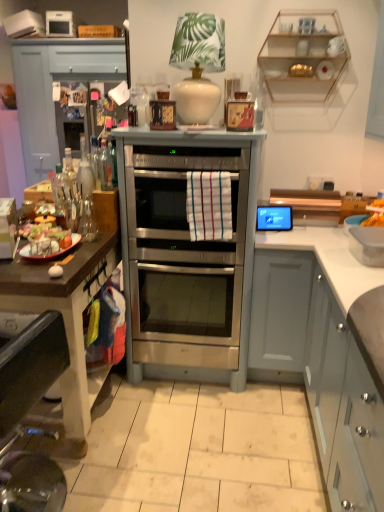
This screenshot has height=512, width=384. What do you see at coordinates (60, 188) in the screenshot?
I see `clear glass bottle at left, acting as the 2th bottle starting from the right` at bounding box center [60, 188].

In order to face clear glass bottle at left, acting as the 2th bottle starting from the right, should I rotate leftwards or rightwards?

A 17.235 degree turn to the left will do.

Locate an element on the screen. shiny plastic tray at left, the 1th food in the front-to-back sequence is located at coordinates (48, 238).

The width and height of the screenshot is (384, 512). Describe the element at coordinates (105, 166) in the screenshot. I see `clear glass bottle at left, the 2th bottle positioned from the left` at that location.

Describe the element at coordinates (209, 205) in the screenshot. This screenshot has width=384, height=512. I see `white striped towel at center` at that location.

Measure the distance between white matte cabinet at right, arranged as the third cabinetry when viewed from the left, and camera.

The depth of white matte cabinet at right, arranged as the third cabinetry when viewed from the left, is 3.59 feet.

Image resolution: width=384 pixels, height=512 pixels. I want to click on clear glass bottle at left, arranged as the first bottle when viewed from the left, so click(60, 188).

Considering the relative positions of shiny plastic tray at left, the 1th food in the front-to-back sequence, and matte black tablet at upper right in the image provided, is shiny plastic tray at left, the 1th food in the front-to-back sequence, to the left of matte black tablet at upper right from the viewer's perspective?

Yes.

Identify the location of appliance that appears on the right of shiny plastic tray at left, arranged as the second food when viewed from the right. This screenshot has height=512, width=384. (274, 218).

Consider the image. Is shiny plastic tray at left, the 1th food in the front-to-back sequence, aimed at matte black tablet at upper right?

No, shiny plastic tray at left, the 1th food in the front-to-back sequence, is not aimed at matte black tablet at upper right.

Considering the relative sizes of shiny plastic tray at left, arranged as the second food when viewed from the right, and matte black tablet at upper right in the image provided, is shiny plastic tray at left, arranged as the second food when viewed from the right, wider than matte black tablet at upper right?

Correct, the width of shiny plastic tray at left, arranged as the second food when viewed from the right, exceeds that of matte black tablet at upper right.

Is matte black tablet at upper right further to camera compared to white striped towel at center?

Yes.

Looking at the image, does matte black tablet at upper right seem bigger or smaller compared to white striped towel at center?

matte black tablet at upper right is smaller than white striped towel at center.

Considering the relative sizes of matte black tablet at upper right and white striped towel at center in the image provided, is matte black tablet at upper right thinner than white striped towel at center?

No.

Is yellow crispy chips at right, marked as the second food in a front-to-back arrangement, spatially inside clear glass shelves at upper right, or outside of it?

yellow crispy chips at right, marked as the second food in a front-to-back arrangement, cannot be found inside clear glass shelves at upper right.

Considering their positions, is yellow crispy chips at right, placed as the 2th food when sorted from left to right, located in front of or behind clear glass shelves at upper right?

yellow crispy chips at right, placed as the 2th food when sorted from left to right, is in front of clear glass shelves at upper right.

Does yellow crispy chips at right, marked as the second food in a front-to-back arrangement, have a greater width compared to clear glass shelves at upper right?

Yes.

Is yellow crispy chips at right, marked as the second food in a front-to-back arrangement, taller than clear glass shelves at upper right?

No.

Which of these two, matte black tablet at upper right or white matte cabinet at center, which ranks as the 2th cabinetry in bottom-to-top order, stands taller?

white matte cabinet at center, which ranks as the 2th cabinetry in bottom-to-top order, is taller.

Can you tell me how much matte black tablet at upper right and white matte cabinet at center, the second cabinetry when ordered from right to left, differ in facing direction?

0.0244 degrees separate the facing orientations of matte black tablet at upper right and white matte cabinet at center, the second cabinetry when ordered from right to left.

In the scene shown: From the image's perspective, is matte black tablet at upper right under white matte cabinet at center, the second cabinetry when ordered from right to left?

No.

Which object is positioned more to the left, matte black tablet at upper right or white matte cabinet at center, the 2th cabinetry viewed from the back?

Positioned to the left is matte black tablet at upper right.

Which is closer, (223, 180) or (334, 23)?

Point (223, 180) appears to be closer to the viewer than point (334, 23).

Which of these two, white striped towel at center or clear glass shelves at upper right, stands shorter?

white striped towel at center is shorter.

Could clear glass shelves at upper right be considered to be inside white striped towel at center?

No, clear glass shelves at upper right is located outside of white striped towel at center.

From the image's perspective, is white matte cabinet at center, the second cabinetry when ordered from right to left, on top of clear glass shelves at upper right?

Incorrect, from the image's perspective, white matte cabinet at center, the second cabinetry when ordered from right to left, is lower than clear glass shelves at upper right.

From a real-world perspective, is white matte cabinet at center, acting as the second cabinetry starting from the front, physically below clear glass shelves at upper right?

Yes, from a real-world perspective, white matte cabinet at center, acting as the second cabinetry starting from the front, is under clear glass shelves at upper right.

Between white matte cabinet at center, acting as the second cabinetry starting from the front, and clear glass shelves at upper right, which one appears on the left side from the viewer's perspective?

From the viewer's perspective, white matte cabinet at center, acting as the second cabinetry starting from the front, appears more on the left side.

Is yellow crispy chips at right, which is the 1th food in back-to-front order, spatially inside stainless steel oven at center, or outside of it?

yellow crispy chips at right, which is the 1th food in back-to-front order, cannot be found inside stainless steel oven at center.

Considering the relative sizes of yellow crispy chips at right, marked as the second food in a front-to-back arrangement, and stainless steel oven at center in the image provided, is yellow crispy chips at right, marked as the second food in a front-to-back arrangement, bigger than stainless steel oven at center?

No.

Between yellow crispy chips at right, marked as the second food in a front-to-back arrangement, and stainless steel oven at center, which one has smaller width?

With smaller width is yellow crispy chips at right, marked as the second food in a front-to-back arrangement.

Consider the image. Can you confirm if yellow crispy chips at right, which is the 1th food in back-to-front order, is taller than stainless steel oven at center?

In fact, yellow crispy chips at right, which is the 1th food in back-to-front order, may be shorter than stainless steel oven at center.

This screenshot has height=512, width=384. I want to click on appliance above the shiny plastic tray at left, the 1th food in the front-to-back sequence (from the image's perspective), so click(274, 218).

At what (x,y) coordinates should I click in order to perform the action: click on appliance behind the white striped towel at center. Please return your answer as a coordinate pair (x, y). The width and height of the screenshot is (384, 512). Looking at the image, I should click on (274, 218).

From the image, which object appears to be nearer to clear glass shelves at upper right, white matte cabinet at center, the second cabinetry when ordered from right to left, or white matte cabinet at right, arranged as the third cabinetry when viewed from the left?

white matte cabinet at center, the second cabinetry when ordered from right to left.

Looking at the image, which one is located closer to clear glass bottle at left, arranged as the first bottle when viewed from the left, matte blue cabinet at left, positioned as the third cabinetry in front-to-back order, or white striped towel at center?

white striped towel at center is closer to clear glass bottle at left, arranged as the first bottle when viewed from the left.

From the image, which object appears to be nearer to shiny plastic tray at left, the 1th food in the front-to-back sequence, yellow crispy chips at right, placed as the 2th food when sorted from left to right, or stainless steel oven at center?

Based on the image, stainless steel oven at center appears to be nearer to shiny plastic tray at left, the 1th food in the front-to-back sequence.

Considering their positions, is stainless steel oven at center positioned further to yellow crispy chips at right, marked as the second food in a front-to-back arrangement, than clear glass shelves at upper right?

stainless steel oven at center is further to yellow crispy chips at right, marked as the second food in a front-to-back arrangement.

Which object lies nearer to the anchor point white matte cabinet at center, which ranks as the 2th cabinetry in bottom-to-top order, brushed metal drawer at upper left or shiny plastic tray at left, arranged as the second food when viewed from the back?

The object closer to white matte cabinet at center, which ranks as the 2th cabinetry in bottom-to-top order, is shiny plastic tray at left, arranged as the second food when viewed from the back.

Looking at the image, which one is located further to clear glass bottle at left, the 2th bottle positioned from the left, clear glass bottle at left, acting as the 2th bottle starting from the right, or matte black tablet at upper right?

matte black tablet at upper right lies further to clear glass bottle at left, the 2th bottle positioned from the left, than the other object.

Which object lies further to the anchor point clear glass shelves at upper right, white matte cabinet at right, which is the 3th cabinetry in top-to-bottom order, or white striped towel at center?

white matte cabinet at right, which is the 3th cabinetry in top-to-bottom order.

When comparing their distances from matte black tablet at upper right, does stainless steel oven at center or clear glass bottle at left, acting as the 2th bottle starting from the right, seem further?

Among the two, clear glass bottle at left, acting as the 2th bottle starting from the right, is located further to matte black tablet at upper right.

The height and width of the screenshot is (512, 384). I want to click on oven between white matte cabinet at center, the 2th cabinetry viewed from the back, and matte blue cabinet at left, which ranks as the 1th cabinetry in left-to-right order, in the front-back direction, so pos(183,259).

You are a GUI agent. You are given a task and a screenshot of the screen. Output one action in this format:
    pyautogui.click(x=<x>, y=<y>)
    Task: Click on the drawer positioned between stainless steel oven at center and matte blue cabinet at left, which ranks as the 1th cabinetry in left-to-right order, from near to far
    The width and height of the screenshot is (384, 512).
    Given the screenshot: What is the action you would take?
    pyautogui.click(x=87, y=59)

Locate an element on the screen. appliance located between shiny plastic tray at left, arranged as the second food when viewed from the right, and matte blue cabinet at left, which appears as the third cabinetry when viewed from the right, in the depth direction is located at coordinates (274, 218).

You are a GUI agent. You are given a task and a screenshot of the screen. Output one action in this format:
    pyautogui.click(x=<x>, y=<y>)
    Task: Click on the blanket between shiny plastic tray at left, the 1th food in the front-to-back sequence, and brushed metal drawer at upper left from front to back
    
    Given the screenshot: What is the action you would take?
    pyautogui.click(x=209, y=205)